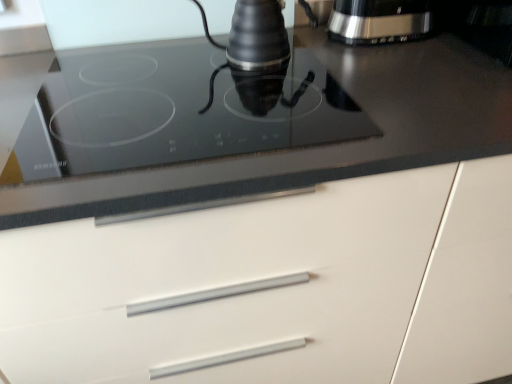
Question: Considering the positions of satin silver coffee maker at upper right and white matte cabinet at center in the image, is satin silver coffee maker at upper right taller or shorter than white matte cabinet at center?

Choices:
 (A) tall
 (B) short

Answer: (B)

Question: Is satin silver coffee maker at upper right spatially inside white matte cabinet at center, or outside of it?

Choices:
 (A) outside
 (B) inside

Answer: (A)

Question: Which object is positioned closest to the white matte cabinet at center?

Choices:
 (A) satin silver coffee maker at upper right
 (B) black glass cooktop at upper center

Answer: (B)

Question: Which of these objects is positioned farthest from the white matte cabinet at center?

Choices:
 (A) satin silver coffee maker at upper right
 (B) black glass cooktop at upper center

Answer: (A)